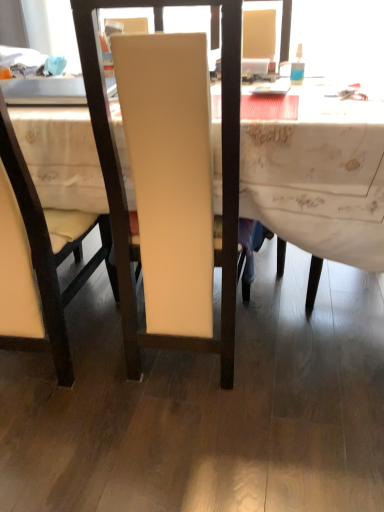
Describe the element at coordinates (125, 192) in the screenshot. The height and width of the screenshot is (512, 384). I see `matte white chair at center, marked as the 1th chair in a right-to-left arrangement` at that location.

You are a GUI agent. You are given a task and a screenshot of the screen. Output one action in this format:
    pyautogui.click(x=<x>, y=<y>)
    Task: Click on the white fabric desk at center
    The width and height of the screenshot is (384, 512).
    Given the screenshot: What is the action you would take?
    pyautogui.click(x=319, y=178)

Is matte white chair at center, arranged as the 2th chair when viewed from the left, positioned beyond the bounds of matte cream chair at center, which is the second chair from right to left?

Indeed, matte white chair at center, arranged as the 2th chair when viewed from the left, is completely outside matte cream chair at center, which is the second chair from right to left.

Based on the photo, between matte white chair at center, marked as the 1th chair in a right-to-left arrangement, and matte cream chair at center, which is the second chair from right to left, which one has smaller size?

With smaller size is matte cream chair at center, which is the second chair from right to left.

Considering the points (119, 264) and (59, 358), which point is in front, point (119, 264) or point (59, 358)?

The point (119, 264) is closer to the camera.

Looking at this image, between matte white chair at center, arranged as the 2th chair when viewed from the left, and matte cream chair at center, which is the second chair from right to left, which one has smaller width?

Thinner between the two is matte cream chair at center, which is the second chair from right to left.

Consider the image. Are white fabric desk at center and translucent plastic bottle at upper right far apart?

They are positioned close to each other.

Considering the positions of objects white fabric desk at center and translucent plastic bottle at upper right in the image provided, who is in front, white fabric desk at center or translucent plastic bottle at upper right?

white fabric desk at center is more forward.

Can you tell me how much white fabric desk at center and translucent plastic bottle at upper right differ in facing direction?

white fabric desk at center and translucent plastic bottle at upper right are facing 5.33 degrees away from each other.

Can you confirm if white fabric desk at center is bigger than matte white chair at center, marked as the 1th chair in a right-to-left arrangement?

Yes, white fabric desk at center is bigger than matte white chair at center, marked as the 1th chair in a right-to-left arrangement.

From the image's perspective, who appears lower, white fabric desk at center or matte white chair at center, arranged as the 2th chair when viewed from the left?

From the image's view, matte white chair at center, arranged as the 2th chair when viewed from the left, is below.

Is white fabric desk at center oriented towards matte white chair at center, marked as the 1th chair in a right-to-left arrangement?

Yes, white fabric desk at center is facing matte white chair at center, marked as the 1th chair in a right-to-left arrangement.

From a real-world perspective, which object rests below the other?

white fabric desk at center, from a real-world perspective.

How far apart are matte cream chair at center, which is the second chair from right to left, and white fabric desk at center?

matte cream chair at center, which is the second chair from right to left, and white fabric desk at center are 23.20 inches apart.

Find the location of a particular element. The width and height of the screenshot is (384, 512). chair that is the 2nd one when counting forward from the white fabric desk at center is located at coordinates (40, 260).

From the image's perspective, is matte cream chair at center, which is the second chair from right to left, on top of white fabric desk at center?

Incorrect, from the image's perspective, matte cream chair at center, which is the second chair from right to left, is lower than white fabric desk at center.

Find the location of `desk behind the matte cream chair at center, which is the second chair from right to left`. desk behind the matte cream chair at center, which is the second chair from right to left is located at coordinates (319, 178).

From a real-world perspective, who is located lower, white fabric desk at center or matte cream chair at center, the 1th chair in the left-to-right sequence?

white fabric desk at center.

What's the angular difference between white fabric desk at center and matte cream chair at center, the 1th chair in the left-to-right sequence,'s facing directions?

white fabric desk at center and matte cream chair at center, the 1th chair in the left-to-right sequence, are facing 0.466 degrees away from each other.

Considering the relative sizes of white fabric desk at center and matte cream chair at center, the 1th chair in the left-to-right sequence, in the image provided, is white fabric desk at center taller than matte cream chair at center, the 1th chair in the left-to-right sequence,?

No.

Identify the location of bottle above the white fabric desk at center (from a real-world perspective). (297, 68).

Between point (296, 83) and point (376, 222), which one is positioned behind?

The point (296, 83) is farther from the camera.

Which of these two, translucent plastic bottle at upper right or white fabric desk at center, stands shorter?

translucent plastic bottle at upper right.

Considering the sizes of objects translucent plastic bottle at upper right and matte cream chair at center, the 1th chair in the left-to-right sequence, in the image provided, who is thinner, translucent plastic bottle at upper right or matte cream chair at center, the 1th chair in the left-to-right sequence,?

translucent plastic bottle at upper right.

How different are the orientations of translucent plastic bottle at upper right and matte cream chair at center, the 1th chair in the left-to-right sequence, in degrees?

The angle between the facing direction of translucent plastic bottle at upper right and the facing direction of matte cream chair at center, the 1th chair in the left-to-right sequence, is 5.8 degrees.

From the image's perspective, is translucent plastic bottle at upper right over matte cream chair at center, the 1th chair in the left-to-right sequence?

Yes, from the image's perspective, translucent plastic bottle at upper right is on top of matte cream chair at center, the 1th chair in the left-to-right sequence.

Is translucent plastic bottle at upper right to the right of matte cream chair at center, which is the second chair from right to left, from the viewer's perspective?

Yes.

Locate an element on the screen. Image resolution: width=384 pixels, height=512 pixels. chair above the matte cream chair at center, which is the second chair from right to left (from the image's perspective) is located at coordinates (125, 192).

The image size is (384, 512). In order to click on desk located below the translucent plastic bottle at upper right (from the image's perspective) in this screenshot , I will do `click(319, 178)`.

From the image, which object appears to be nearer to matte white chair at center, marked as the 1th chair in a right-to-left arrangement, matte cream chair at center, which is the second chair from right to left, or white fabric desk at center?

white fabric desk at center lies closer to matte white chair at center, marked as the 1th chair in a right-to-left arrangement, than the other object.

From the image, which object appears to be nearer to translucent plastic bottle at upper right, white fabric desk at center or matte white chair at center, arranged as the 2th chair when viewed from the left?

white fabric desk at center lies closer to translucent plastic bottle at upper right than the other object.

Estimate the real-world distances between objects in this image. Which object is further from matte white chair at center, marked as the 1th chair in a right-to-left arrangement, white fabric desk at center or translucent plastic bottle at upper right?

translucent plastic bottle at upper right is further to matte white chair at center, marked as the 1th chair in a right-to-left arrangement.

Which object lies further to the anchor point matte cream chair at center, which is the second chair from right to left, white fabric desk at center or translucent plastic bottle at upper right?

translucent plastic bottle at upper right is positioned further to the anchor matte cream chair at center, which is the second chair from right to left.

Looking at this image, estimate the real-world distances between objects in this image. Which object is further from matte cream chair at center, which is the second chair from right to left, translucent plastic bottle at upper right or matte white chair at center, arranged as the 2th chair when viewed from the left?

The object further to matte cream chair at center, which is the second chair from right to left, is translucent plastic bottle at upper right.

Which object lies nearer to the anchor point matte white chair at center, marked as the 1th chair in a right-to-left arrangement, white fabric desk at center or matte cream chair at center, which is the second chair from right to left?

white fabric desk at center is positioned closer to the anchor matte white chair at center, marked as the 1th chair in a right-to-left arrangement.

When comparing their distances from matte cream chair at center, the 1th chair in the left-to-right sequence, does matte white chair at center, marked as the 1th chair in a right-to-left arrangement, or translucent plastic bottle at upper right seem further?

translucent plastic bottle at upper right lies further to matte cream chair at center, the 1th chair in the left-to-right sequence, than the other object.

When comparing their distances from translucent plastic bottle at upper right, does matte cream chair at center, which is the second chair from right to left, or white fabric desk at center seem further?

matte cream chair at center, which is the second chair from right to left, lies further to translucent plastic bottle at upper right than the other object.

The height and width of the screenshot is (512, 384). In order to click on chair located between matte cream chair at center, the 1th chair in the left-to-right sequence, and white fabric desk at center in the left-right direction in this screenshot , I will do `click(125, 192)`.

The image size is (384, 512). Identify the location of chair situated between matte cream chair at center, the 1th chair in the left-to-right sequence, and translucent plastic bottle at upper right from left to right. (125, 192).

Locate an element on the screen. Image resolution: width=384 pixels, height=512 pixels. desk between matte cream chair at center, the 1th chair in the left-to-right sequence, and translucent plastic bottle at upper right, in the horizontal direction is located at coordinates (319, 178).

Where is `desk between matte white chair at center, arranged as the 2th chair when viewed from the left, and translucent plastic bottle at upper right in the front-back direction`? desk between matte white chair at center, arranged as the 2th chair when viewed from the left, and translucent plastic bottle at upper right in the front-back direction is located at coordinates (319, 178).